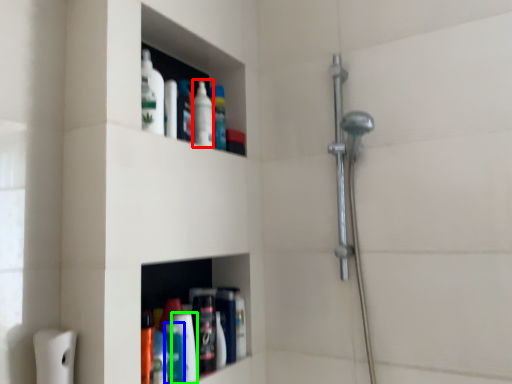
Question: Which object is the farthest from mouthwash (highlighted by a red box)? Choose among these: mouthwash (highlighted by a blue box) or cleaning product (highlighted by a green box).

Choices:
 (A) mouthwash
 (B) cleaning product

Answer: (A)